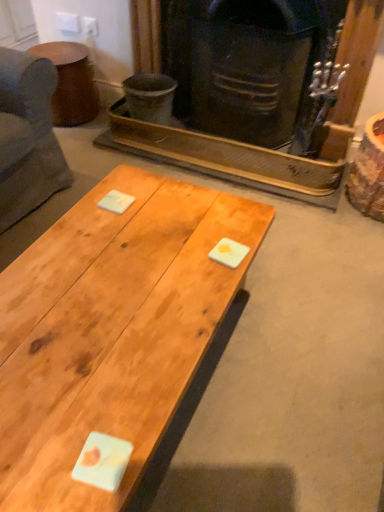
At what (x,y) coordinates should I click in order to perform the action: click on free point above brown matte side table at upper left (from a real-world perspective). Please return your answer as a coordinate pair (x, y). The image size is (384, 512). Looking at the image, I should click on (57, 50).